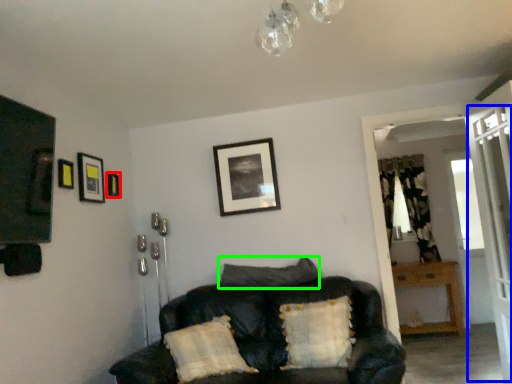
Question: Which is nearer to the picture frame (highlighted by a red box)? screen door (highlighted by a blue box) or pillow (highlighted by a green box).

Choices:
 (A) screen door
 (B) pillow

Answer: (B)